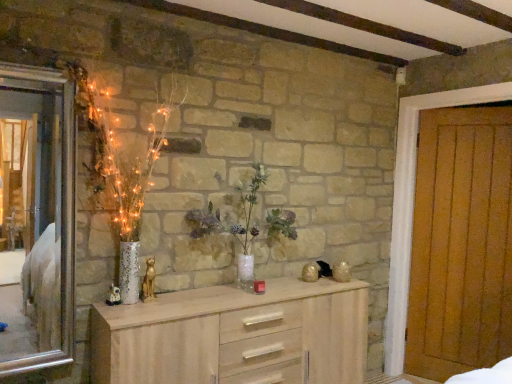
Question: Considering the relative positions of translucent glass vase at center and wooden door at right in the image provided, is translucent glass vase at center behind wooden door at right?

Choices:
 (A) no
 (B) yes

Answer: (A)

Question: Can you confirm if translucent glass vase at center is shorter than wooden door at right?

Choices:
 (A) no
 (B) yes

Answer: (B)

Question: Is the depth of translucent glass vase at center less than that of wooden door at right?

Choices:
 (A) yes
 (B) no

Answer: (A)

Question: Does translucent glass vase at center have a lesser width compared to wooden door at right?

Choices:
 (A) yes
 (B) no

Answer: (B)

Question: Does translucent glass vase at center appear on the right side of wooden door at right?

Choices:
 (A) no
 (B) yes

Answer: (A)

Question: Considering their positions, is wooden door at right located in front of or behind silver metallic mirror at left?

Choices:
 (A) behind
 (B) front

Answer: (A)

Question: Is wooden door at right wider or thinner than silver metallic mirror at left?

Choices:
 (A) wide
 (B) thin

Answer: (A)

Question: From a real-world perspective, is wooden door at right above or below silver metallic mirror at left?

Choices:
 (A) above
 (B) below

Answer: (B)

Question: In terms of size, does wooden door at right appear bigger or smaller than silver metallic mirror at left?

Choices:
 (A) big
 (B) small

Answer: (A)

Question: Considering the positions of light wood chest of drawers at center and wooden door at right in the image, is light wood chest of drawers at center wider or thinner than wooden door at right?

Choices:
 (A) thin
 (B) wide

Answer: (B)

Question: Relative to wooden door at right, is light wood chest of drawers at center in front or behind?

Choices:
 (A) behind
 (B) front

Answer: (B)

Question: From the image's perspective, is light wood chest of drawers at center located above or below wooden door at right?

Choices:
 (A) above
 (B) below

Answer: (B)

Question: Is light wood chest of drawers at center taller or shorter than wooden door at right?

Choices:
 (A) short
 (B) tall

Answer: (A)

Question: Is silver metallic mirror at left bigger or smaller than translucent glass vase at center?

Choices:
 (A) big
 (B) small

Answer: (B)

Question: Based on their positions, is silver metallic mirror at left located to the left or right of translucent glass vase at center?

Choices:
 (A) left
 (B) right

Answer: (A)